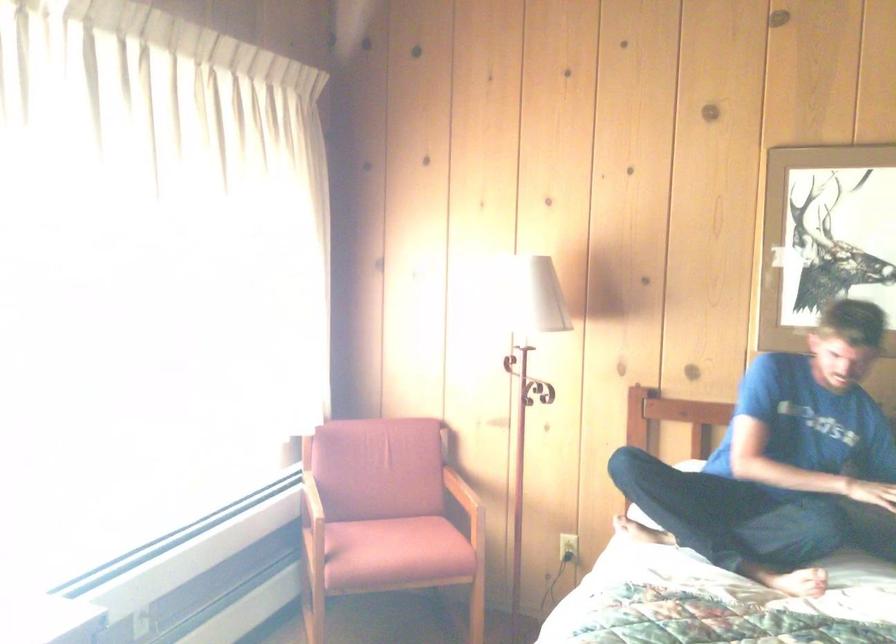
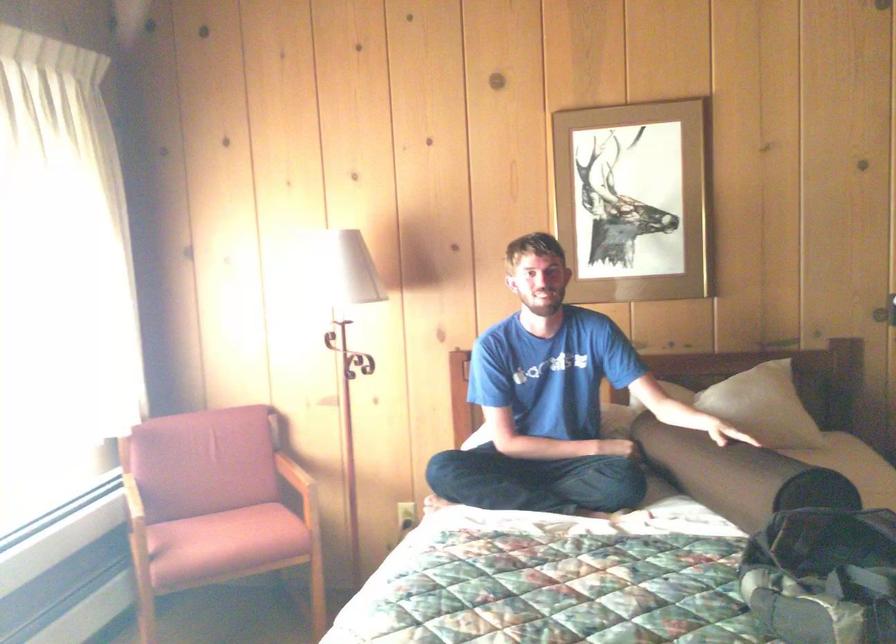
Find the pixel in the second image that matches pixel 536 290 in the first image.

(350, 269)